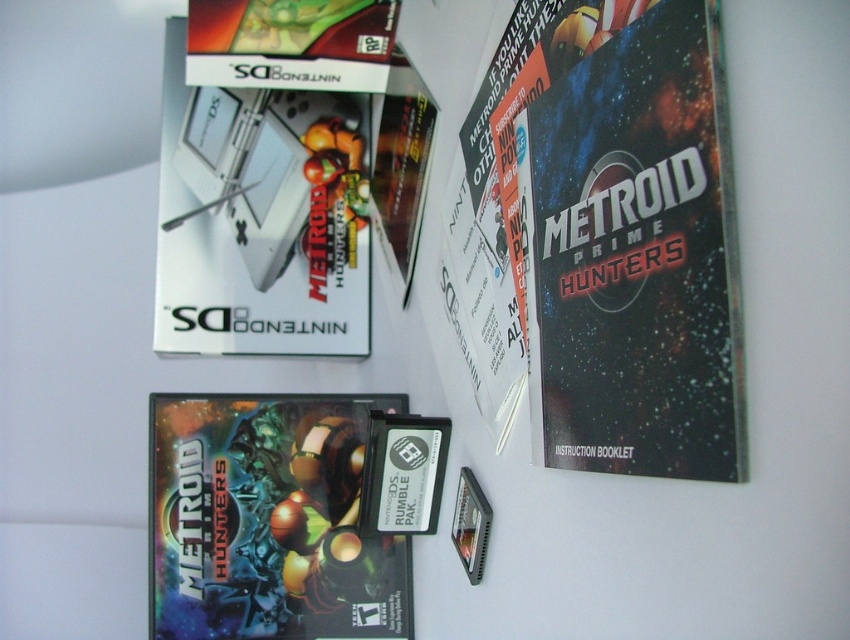
Question: Where is metallic silver instruction booklet at upper right located in relation to white glossy nintendo ds at upper left in the image?

Choices:
 (A) right
 (B) left

Answer: (A)

Question: Is metallic silver instruction booklet at upper right below white glossy nintendo ds at upper left?

Choices:
 (A) yes
 (B) no

Answer: (A)

Question: Among these points, which one is farthest from the camera?

Choices:
 (A) (344, 180)
 (B) (670, 100)

Answer: (A)

Question: Which object appears closest to the camera in this image?

Choices:
 (A) metallic silver instruction booklet at upper right
 (B) white glossy nintendo ds at upper left

Answer: (A)

Question: Is metallic silver instruction booklet at upper right to the left of white glossy nintendo ds at upper left from the viewer's perspective?

Choices:
 (A) no
 (B) yes

Answer: (A)